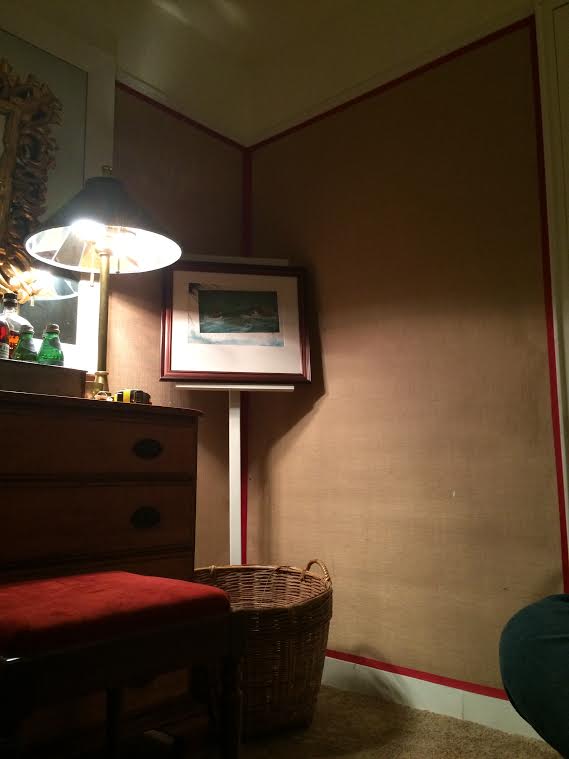
The width and height of the screenshot is (569, 759). I want to click on light is turned on, so click(125, 215).